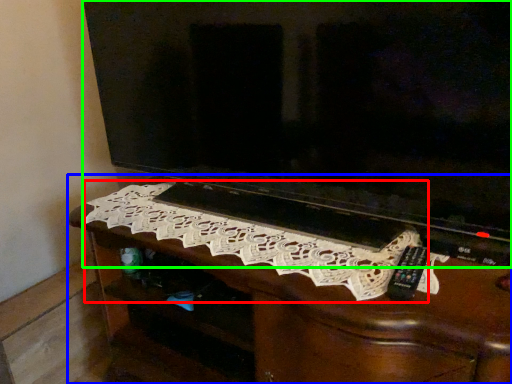
Question: Estimate the real-world distances between objects in this image. Which object is closer to embroidery (highlighted by a red box), furniture (highlighted by a blue box) or television (highlighted by a green box)?

Choices:
 (A) furniture
 (B) television

Answer: (A)